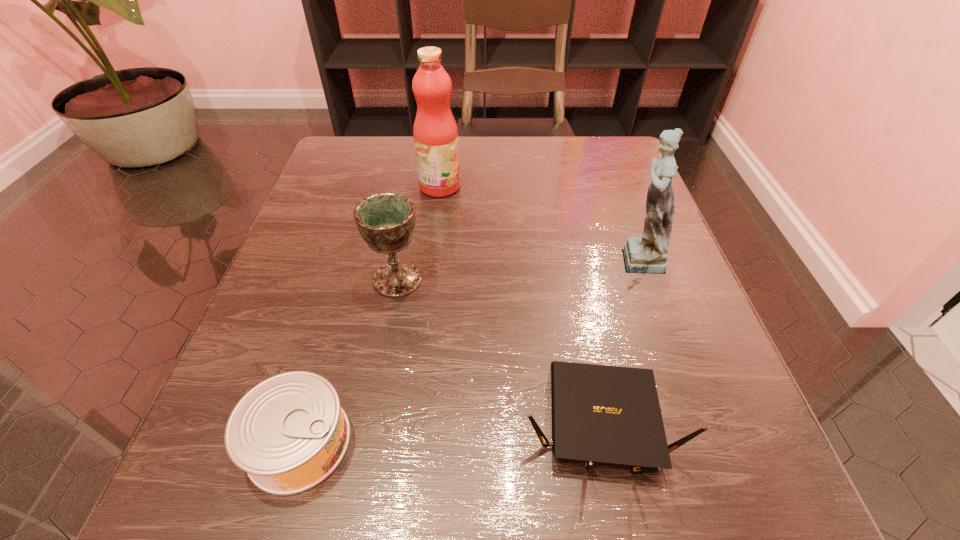
Where is `vacant area at the far edge of the desktop`? The width and height of the screenshot is (960, 540). vacant area at the far edge of the desktop is located at coordinates (551, 141).

In the image, there is a desktop. Identify the location of blank space at the near edge. (574, 523).

The width and height of the screenshot is (960, 540). What are the coordinates of `free space at the left edge of the desktop` in the screenshot? It's located at (341, 338).

The width and height of the screenshot is (960, 540). I want to click on free space at the right edge, so click(x=668, y=381).

Where is `vacant space at the far left corner of the desktop`? The width and height of the screenshot is (960, 540). vacant space at the far left corner of the desktop is located at coordinates (341, 166).

Locate an element on the screen. Image resolution: width=960 pixels, height=540 pixels. vacant space at the far right corner is located at coordinates (573, 144).

This screenshot has width=960, height=540. In the image, there is a desktop. What are the coordinates of `free space at the near right corner` in the screenshot? It's located at (713, 466).

Locate an element on the screen. The height and width of the screenshot is (540, 960). free space between the router and the third shortest object is located at coordinates pos(497,351).

Identify the location of free space between the figurine and the third tallest object. The width and height of the screenshot is (960, 540). (516, 268).

Locate an element on the screen. vacant point located between the fourth tallest object and the fruit juice is located at coordinates (518, 305).